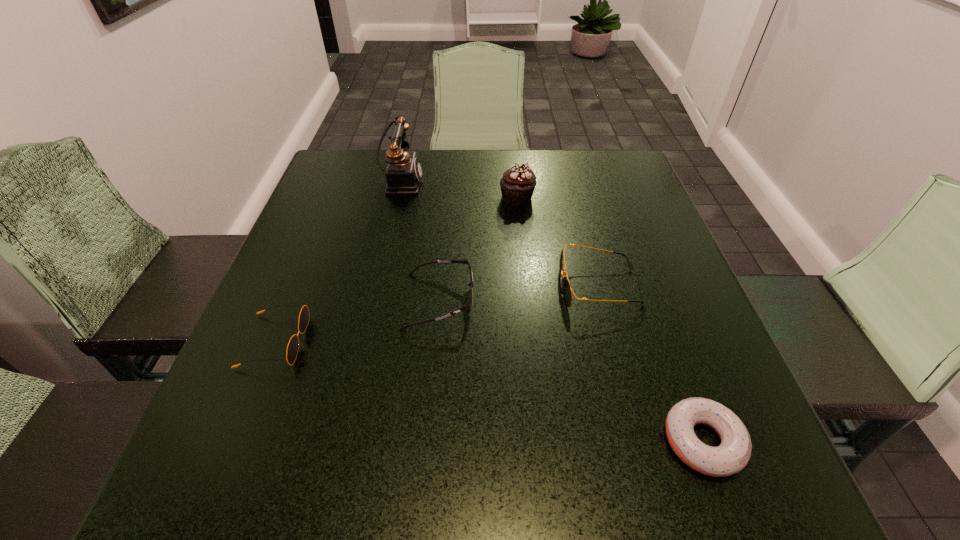
Locate an element on the screen. The height and width of the screenshot is (540, 960). vacant space located on the front-facing side of the second sunglasses from right to left is located at coordinates (600, 301).

Locate an element on the screen. vacant space located 0.370m on the front-facing side of the rightmost sunglasses is located at coordinates (377, 287).

I want to click on vacant space located 0.210m on the front-facing side of the rightmost sunglasses, so click(x=456, y=287).

Where is `vacant space located on the front-facing side of the rightmost sunglasses`? The width and height of the screenshot is (960, 540). vacant space located on the front-facing side of the rightmost sunglasses is located at coordinates (362, 287).

Locate an element on the screen. vacant space located 0.190m on the front-facing side of the leftmost object is located at coordinates (409, 341).

The height and width of the screenshot is (540, 960). I want to click on free space located 0.330m on the back of the nearest object, so click(x=637, y=265).

At what (x,y) coordinates should I click in order to perform the action: click on telephone that is at the far edge. Please return your answer as a coordinate pair (x, y). Looking at the image, I should click on click(404, 173).

Where is `cupcake situated at the far edge`? This screenshot has width=960, height=540. cupcake situated at the far edge is located at coordinates (517, 185).

You are a GUI agent. You are given a task and a screenshot of the screen. Output one action in this format:
    pyautogui.click(x=<x>, y=<y>)
    Task: Click on the object that is at the near edge
    
    Given the screenshot: What is the action you would take?
    pyautogui.click(x=732, y=455)

The width and height of the screenshot is (960, 540). I want to click on telephone that is at the left edge, so click(404, 173).